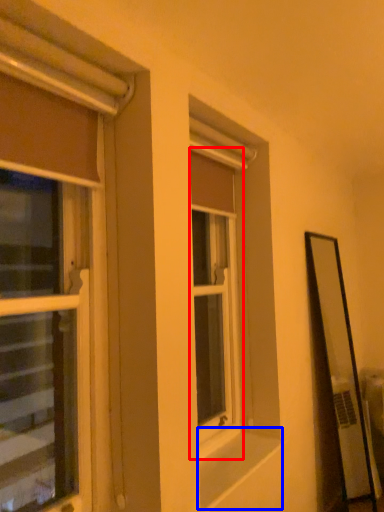
Question: Which point is further to the camera, window (highlighted by a red box) or window sill (highlighted by a blue box)?

Choices:
 (A) window
 (B) window sill

Answer: (A)